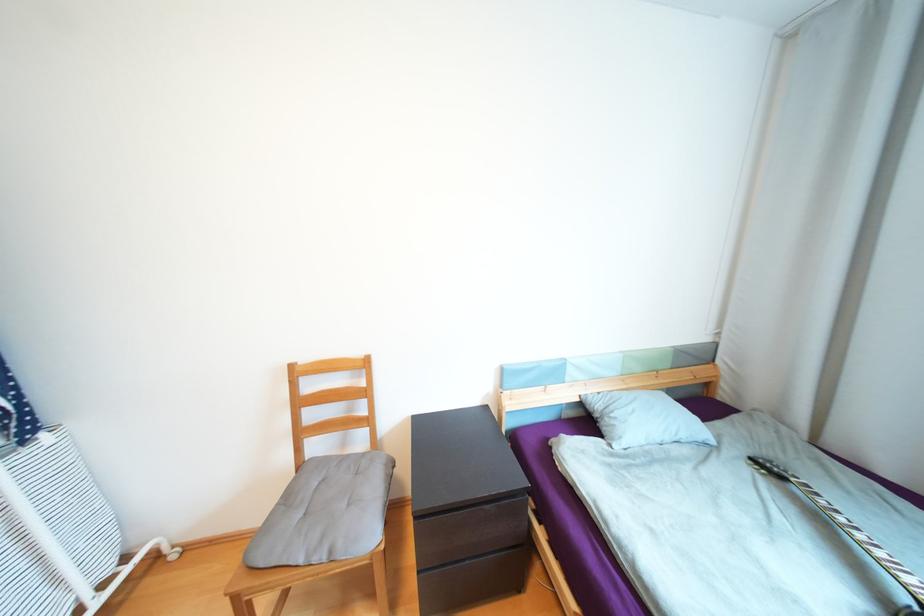
Where would you lift the grey pillow? Please return your answer as a coordinate pair (x, y).

(643, 419)